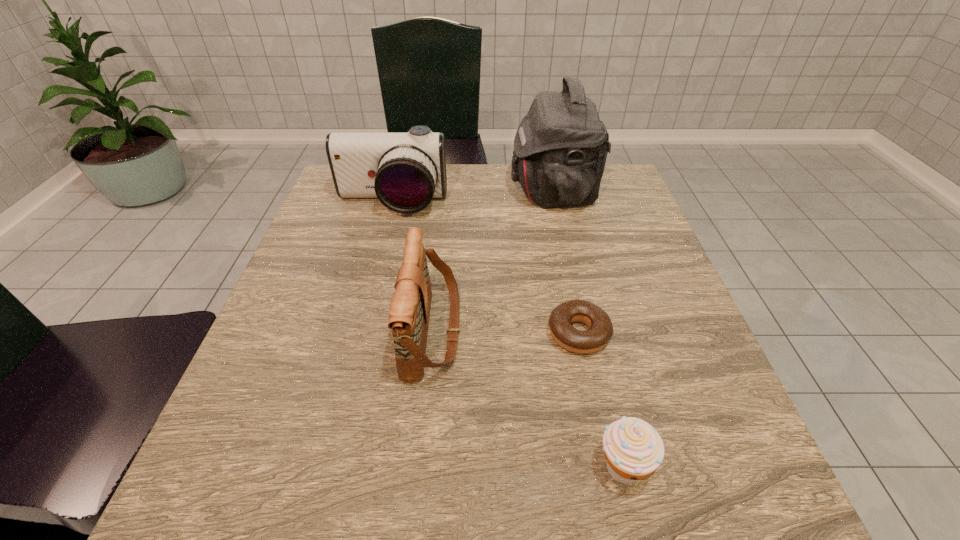
I want to click on vacant space that is in between the farther shoulder bag and the shortest object, so click(566, 262).

Locate an element on the screen. The width and height of the screenshot is (960, 540). blank region between the shortest object and the shorter shoulder bag is located at coordinates (506, 333).

The height and width of the screenshot is (540, 960). What are the coordinates of `unoccupied position between the camcorder and the tallest object` in the screenshot? It's located at (472, 197).

Where is `blank region between the second shortest object and the camcorder`? blank region between the second shortest object and the camcorder is located at coordinates (507, 335).

Find the location of a particular element. The image size is (960, 540). free area in between the camcorder and the farther shoulder bag is located at coordinates (472, 197).

Image resolution: width=960 pixels, height=540 pixels. What are the coordinates of `vacant region between the camcorder and the shortest object` in the screenshot? It's located at (485, 268).

At what (x,y) coordinates should I click in order to perform the action: click on free point between the fourth tallest object and the nearer shoulder bag. Please return your answer as a coordinate pair (x, y). Image resolution: width=960 pixels, height=540 pixels. Looking at the image, I should click on 527,400.

Where is `blank region between the tallest object and the doughnut`? The image size is (960, 540). blank region between the tallest object and the doughnut is located at coordinates (566, 262).

Where is `object that ranks as the second closest to the muffin`? The width and height of the screenshot is (960, 540). object that ranks as the second closest to the muffin is located at coordinates (409, 313).

Select which object appears as the closest to the nearer shoulder bag. Please provide its 2D coordinates. Your answer should be formatted as a tuple, i.e. [(x, y)], where the tuple contains the x and y coordinates of a point satisfying the conditions above.

[(600, 331)]